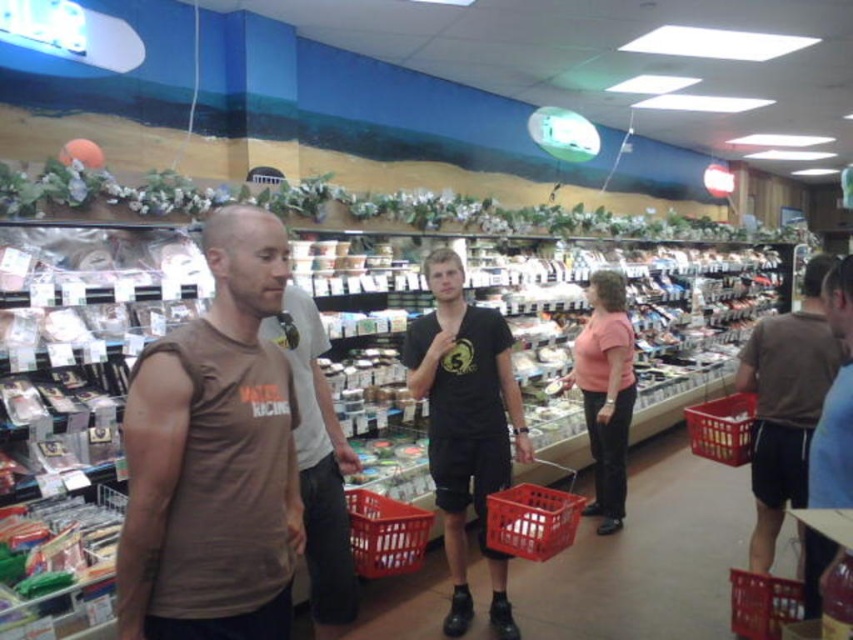
Question: Is pink matte shirt at center closer to camera compared to red plastic basket at center?

Choices:
 (A) no
 (B) yes

Answer: (A)

Question: Which of the following is the farthest from the observer?

Choices:
 (A) red plastic basket at center-right
 (B) black matte t-shirt at center

Answer: (A)

Question: Among these points, which one is nearest to the camera?

Choices:
 (A) (492, 515)
 (B) (210, 394)

Answer: (B)

Question: Does blue cotton shirt at right appear on the left side of plastic basket at lower right?

Choices:
 (A) no
 (B) yes

Answer: (A)

Question: Which of the following is the closest to the observer?

Choices:
 (A) (381, 554)
 (B) (440, 499)
 (C) (277, 570)
 (D) (724, 424)

Answer: (C)

Question: Can you confirm if pink matte shirt at center is positioned above red plastic basket at center?

Choices:
 (A) no
 (B) yes

Answer: (B)